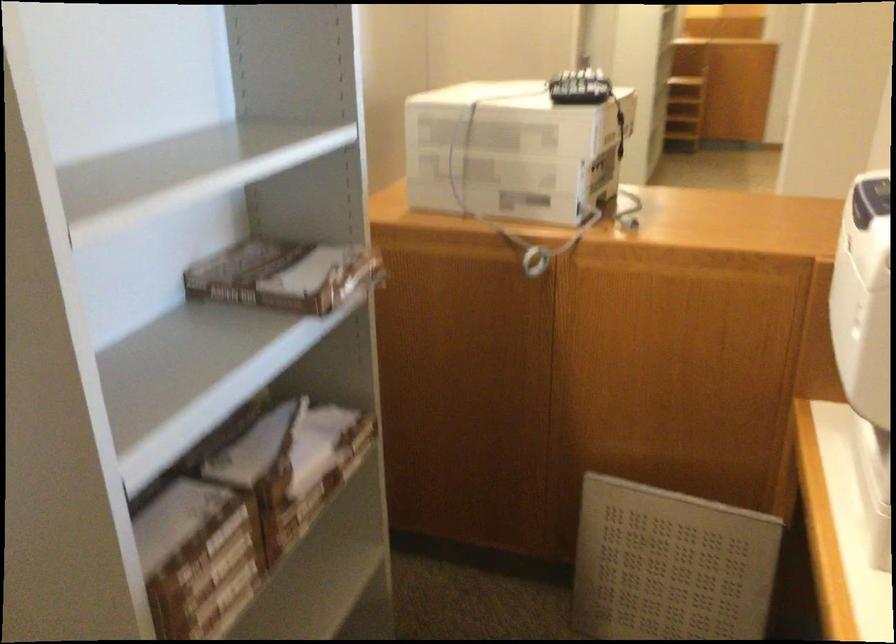
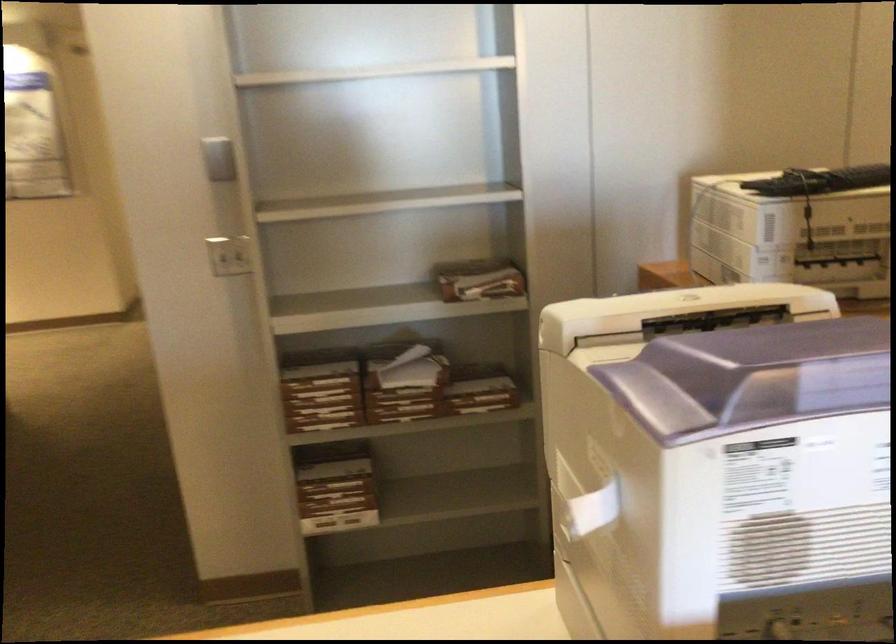
Locate, in the second image, the point that corresponds to point (287, 488) in the first image.

(398, 389)